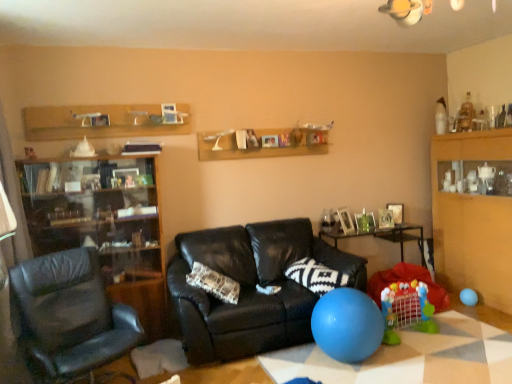
Find the location of a particular element. The image size is (512, 384). vacant area located to the right-hand side of plastic colorful playpen at lower right is located at coordinates (457, 333).